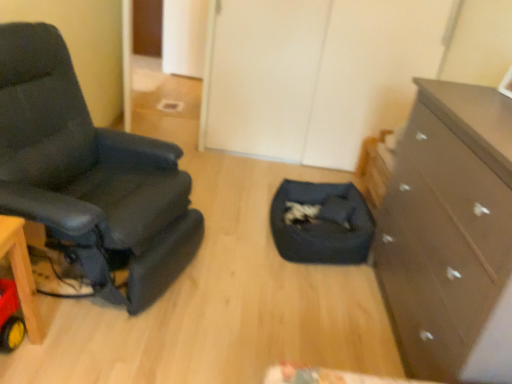
Question: Considering the relative sizes of black leather chair at left and dark brown wooden chest of drawers at right in the image provided, is black leather chair at left wider than dark brown wooden chest of drawers at right?

Choices:
 (A) no
 (B) yes

Answer: (B)

Question: Is black leather chair at left directly adjacent to dark brown wooden chest of drawers at right?

Choices:
 (A) yes
 (B) no

Answer: (B)

Question: Does black leather chair at left appear on the right side of dark brown wooden chest of drawers at right?

Choices:
 (A) no
 (B) yes

Answer: (A)

Question: Is black leather chair at left far from dark brown wooden chest of drawers at right?

Choices:
 (A) no
 (B) yes

Answer: (B)

Question: Is black leather chair at left completely or partially outside of dark brown wooden chest of drawers at right?

Choices:
 (A) no
 (B) yes

Answer: (B)

Question: From the image's perspective, is black leather chair at left on dark brown wooden chest of drawers at right?

Choices:
 (A) no
 (B) yes

Answer: (B)

Question: Is dark blue fabric pet bed at center facing away from dark brown wooden chest of drawers at right?

Choices:
 (A) no
 (B) yes

Answer: (A)

Question: Is dark blue fabric pet bed at center far from dark brown wooden chest of drawers at right?

Choices:
 (A) no
 (B) yes

Answer: (A)

Question: Would you say dark blue fabric pet bed at center contains dark brown wooden chest of drawers at right?

Choices:
 (A) no
 (B) yes

Answer: (A)

Question: Is dark blue fabric pet bed at center positioned before dark brown wooden chest of drawers at right?

Choices:
 (A) yes
 (B) no

Answer: (B)

Question: Is dark blue fabric pet bed at center positioned behind dark brown wooden chest of drawers at right?

Choices:
 (A) yes
 (B) no

Answer: (A)

Question: Considering the relative sizes of dark blue fabric pet bed at center and dark brown wooden chest of drawers at right in the image provided, is dark blue fabric pet bed at center thinner than dark brown wooden chest of drawers at right?

Choices:
 (A) no
 (B) yes

Answer: (A)

Question: Does dark brown wooden chest of drawers at right appear on the left side of dark blue fabric pet bed at center?

Choices:
 (A) yes
 (B) no

Answer: (B)